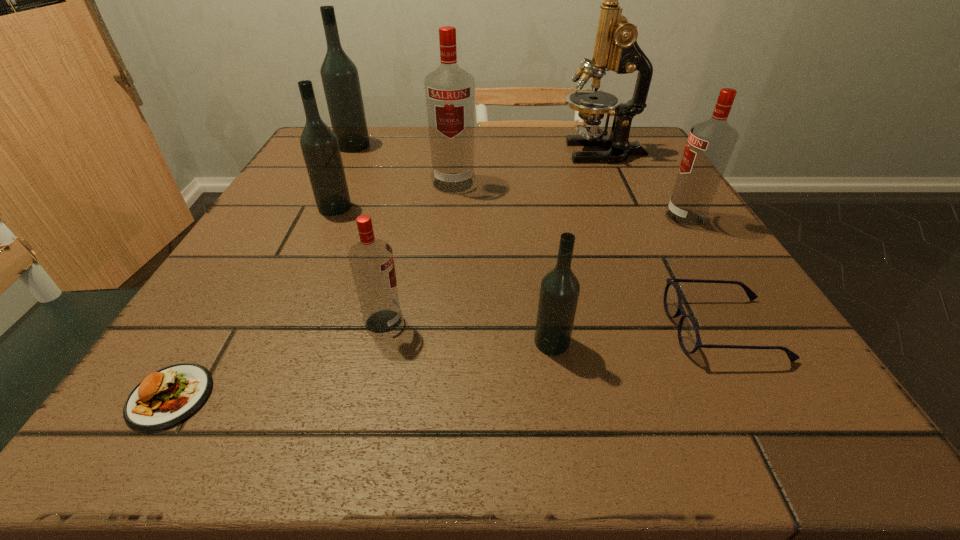
Where is `unoccupied position between the shortest object and the rightmost red vodka`? unoccupied position between the shortest object and the rightmost red vodka is located at coordinates (427, 307).

Image resolution: width=960 pixels, height=540 pixels. Find the location of `vacant space that is in between the eighth tallest object and the shortest object`. vacant space that is in between the eighth tallest object and the shortest object is located at coordinates (447, 363).

Locate an element on the screen. Image resolution: width=960 pixels, height=540 pixels. free space between the second shortest object and the nearest black vodka is located at coordinates (637, 335).

Identify which object is located as the nearest to the nearest red vodka. Please provide its 2D coordinates. Your answer should be formatted as a tuple, i.e. [(x, y)], where the tuple contains the x and y coordinates of a point satisfying the conditions above.

[(164, 398)]

This screenshot has height=540, width=960. Identify the location of the eighth closest object relative to the rightmost red vodka. (164, 398).

Locate which vodka is the fourth closest to the microscope. Please provide its 2D coordinates. Your answer should be formatted as a tuple, i.e. [(x, y)], where the tuple contains the x and y coordinates of a point satisfying the conditions above.

[(319, 144)]

This screenshot has width=960, height=540. I want to click on vodka object that ranks as the second closest to the sixth object from left to right, so click(x=710, y=144).

Identify which black vodka is the second nearest to the second biggest black vodka. Please provide its 2D coordinates. Your answer should be formatted as a tuple, i.e. [(x, y)], where the tuple contains the x and y coordinates of a point satisfying the conditions above.

[(559, 291)]

Identify the location of the third closest black vodka to the second shortest object. (340, 79).

The image size is (960, 540). In order to click on red vodka that can be found as the second closest to the fifth nearest vodka in this screenshot , I will do `click(710, 144)`.